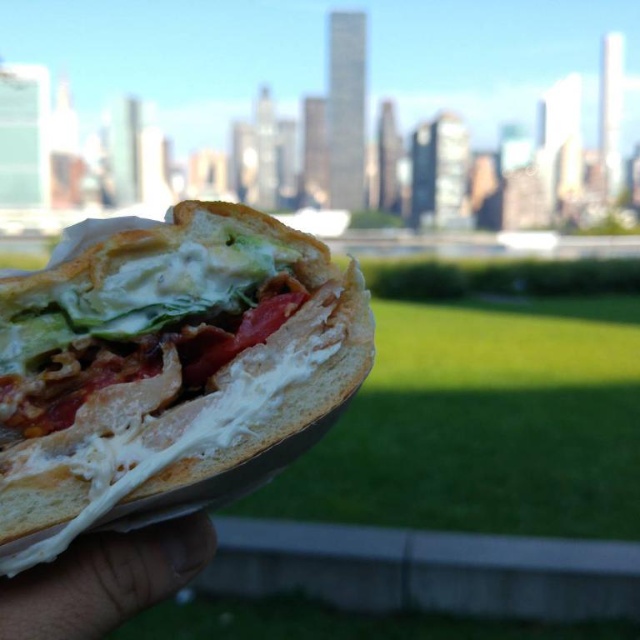
Question: Does white soft bread at center come behind skinny white hand at lower left?

Choices:
 (A) no
 (B) yes

Answer: (B)

Question: Observing the image, what is the correct spatial positioning of white soft bread at center in reference to skinny white hand at lower left?

Choices:
 (A) left
 (B) right

Answer: (B)

Question: Among these points, which one is nearest to the camera?

Choices:
 (A) (307, 323)
 (B) (141, 577)

Answer: (B)

Question: Which point is farther to the camera?

Choices:
 (A) (92, 554)
 (B) (198, 298)

Answer: (B)

Question: Which point appears closest to the camera in this image?

Choices:
 (A) (276, 236)
 (B) (157, 593)

Answer: (B)

Question: Can you confirm if white soft bread at center is smaller than skinny white hand at lower left?

Choices:
 (A) yes
 (B) no

Answer: (B)